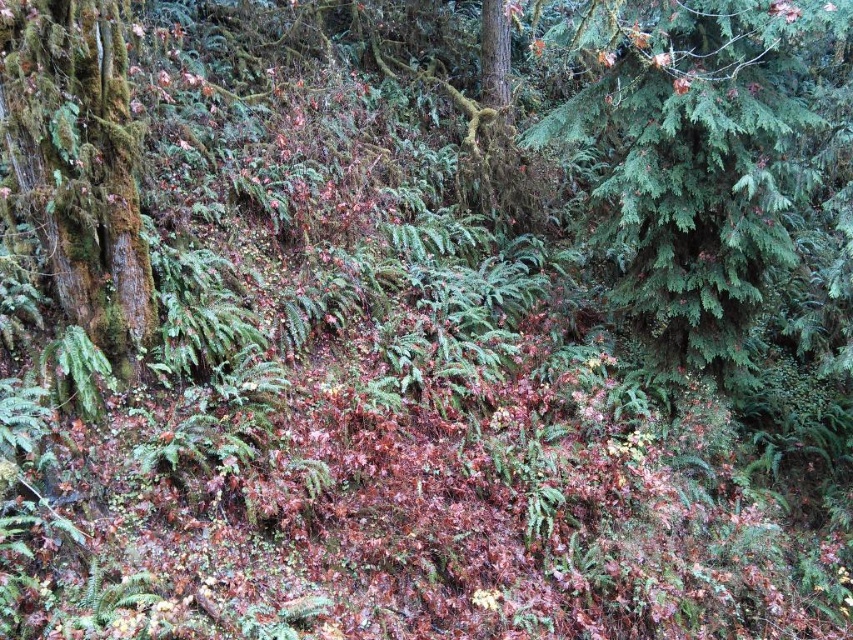
Question: Which of the following is the farthest from the observer?

Choices:
 (A) green needle-like at upper right
 (B) green mossy tree at left

Answer: (A)

Question: Is green needle-like at upper right to the right of green mossy tree at left from the viewer's perspective?

Choices:
 (A) yes
 (B) no

Answer: (A)

Question: Which point appears farthest from the camera in this image?

Choices:
 (A) (718, 166)
 (B) (68, 168)

Answer: (A)

Question: Does green needle-like at upper right have a greater width compared to green mossy tree at left?

Choices:
 (A) yes
 (B) no

Answer: (A)

Question: Is green needle-like at upper right to the left of green mossy tree at left from the viewer's perspective?

Choices:
 (A) yes
 (B) no

Answer: (B)